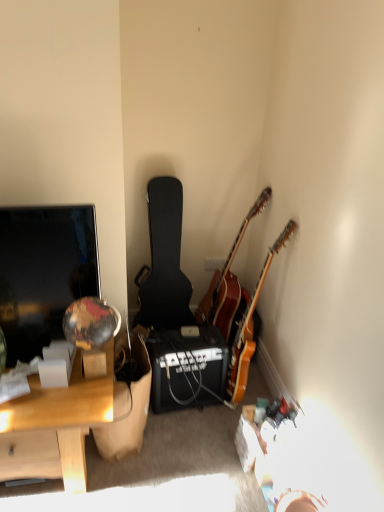
What do you see at coordinates (227, 281) in the screenshot? This screenshot has height=512, width=384. I see `wooden acoustic guitar at corner, which is the second guitar in left-to-right order` at bounding box center [227, 281].

The width and height of the screenshot is (384, 512). What are the coordinates of `black textured guitar case at center, which is the 1th guitar in left-to-right order` in the screenshot? It's located at (164, 261).

This screenshot has width=384, height=512. In order to click on wooden acoustic guitar at corner, which is the 2th guitar in right-to-left order in this screenshot , I will do `click(227, 281)`.

Can you confirm if black textured guitar case at center, which is the 1th guitar in left-to-right order, is shorter than black matte amplifier at center?

In fact, black textured guitar case at center, which is the 1th guitar in left-to-right order, may be taller than black matte amplifier at center.

Is black textured guitar case at center, which is the 1th guitar in left-to-right order, in contact with black matte amplifier at center?

No, black textured guitar case at center, which is the 1th guitar in left-to-right order, is not touching black matte amplifier at center.

From the image's perspective, is black textured guitar case at center, the 3th guitar viewed from the right, under black matte amplifier at center?

No, from the image's perspective, black textured guitar case at center, the 3th guitar viewed from the right, is not below black matte amplifier at center.

Locate an element on the screen. The height and width of the screenshot is (512, 384). guitar located on the left of black matte amplifier at center is located at coordinates (164, 261).

Is wooden acoustic guitar at corner, which is the second guitar in left-to-right order, thinner than matte black screen at left?

Incorrect, the width of wooden acoustic guitar at corner, which is the second guitar in left-to-right order, is not less than that of matte black screen at left.

Is wooden acoustic guitar at corner, which is the 2th guitar in right-to-left order, taller than matte black screen at left?

Indeed, wooden acoustic guitar at corner, which is the 2th guitar in right-to-left order, has a greater height compared to matte black screen at left.

What's the angular difference between wooden acoustic guitar at corner, which is the second guitar in left-to-right order, and matte black screen at left's facing directions?

The angle between the facing direction of wooden acoustic guitar at corner, which is the second guitar in left-to-right order, and the facing direction of matte black screen at left is 97.2 degrees.

Are wooden acoustic guitar at corner, which is the second guitar in left-to-right order, and matte black screen at left beside each other?

No, wooden acoustic guitar at corner, which is the second guitar in left-to-right order, is not with matte black screen at left.

Is wooden acoustic guitar at upper right, the first guitar positioned from the right, next to wooden acoustic guitar at corner, which is the second guitar in left-to-right order?

There is a gap between wooden acoustic guitar at upper right, the first guitar positioned from the right, and wooden acoustic guitar at corner, which is the second guitar in left-to-right order.

Considering the sizes of wooden acoustic guitar at upper right, the first guitar positioned from the right, and wooden acoustic guitar at corner, which is the second guitar in left-to-right order, in the image, is wooden acoustic guitar at upper right, the first guitar positioned from the right, bigger or smaller than wooden acoustic guitar at corner, which is the second guitar in left-to-right order,?

wooden acoustic guitar at upper right, the first guitar positioned from the right, is smaller than wooden acoustic guitar at corner, which is the second guitar in left-to-right order.

Is wooden acoustic guitar at upper right, the first guitar positioned from the right, wider than wooden acoustic guitar at corner, which is the second guitar in left-to-right order?

No.

Does point (257, 295) come behind point (226, 337)?

No, it is in front of (226, 337).

From the picture: Does wooden acoustic guitar at upper right, marked as the third guitar in a left-to-right arrangement, turn towards black textured guitar case at center, the 3th guitar viewed from the right?

No, wooden acoustic guitar at upper right, marked as the third guitar in a left-to-right arrangement, is not aimed at black textured guitar case at center, the 3th guitar viewed from the right.

From a real-world perspective, count 1st guitars upward from the wooden acoustic guitar at upper right, marked as the third guitar in a left-to-right arrangement, and point to it. Please provide its 2D coordinates.

[(164, 261)]

Would you say wooden acoustic guitar at upper right, the first guitar positioned from the right, is inside or outside black textured guitar case at center, the 3th guitar viewed from the right?

Answer: wooden acoustic guitar at upper right, the first guitar positioned from the right, lies outside black textured guitar case at center, the 3th guitar viewed from the right.

From the picture: In terms of width, does wooden acoustic guitar at upper right, the first guitar positioned from the right, look wider or thinner when compared to black textured guitar case at center, which is the 1th guitar in left-to-right order?

Clearly, wooden acoustic guitar at upper right, the first guitar positioned from the right, has less width compared to black textured guitar case at center, which is the 1th guitar in left-to-right order.

From a real-world perspective, which object stands above the other?

In real-world perspective, matte black screen at left is above.

Is matte black screen at left beside wooden desk at left?

No.

Is matte black screen at left not inside wooden desk at left?

Yes, matte black screen at left is located beyond the bounds of wooden desk at left.

Based on the photo, does matte black screen at left appear on the left side of wooden desk at left?

In fact, matte black screen at left is to the right of wooden desk at left.

From the image's perspective, which object appears higher, wooden desk at left or black textured guitar case at center, which is the 1th guitar in left-to-right order?

black textured guitar case at center, which is the 1th guitar in left-to-right order, appears higher in the image.

Is wooden desk at left not close to black textured guitar case at center, the 3th guitar viewed from the right?

No, wooden desk at left is not far away from black textured guitar case at center, the 3th guitar viewed from the right.

Looking at the image, does wooden desk at left seem bigger or smaller compared to black matte amplifier at center?

Clearly, wooden desk at left is larger in size than black matte amplifier at center.

Locate an element on the screen. desk that is on the left side of black matte amplifier at center is located at coordinates (55, 426).

Are wooden desk at left and black matte amplifier at center located far from each other?

No, wooden desk at left is not far from black matte amplifier at center.

There is a black matte amplifier at center. At what (x,y) coordinates should I click in order to perform the action: click on the 2nd guitar above it (from the image's perspective). Please return your answer as a coordinate pair (x, y). Image resolution: width=384 pixels, height=512 pixels. Looking at the image, I should click on (164, 261).

Locate an element on the screen. Image resolution: width=384 pixels, height=512 pixels. television located in front of the wooden acoustic guitar at corner, which is the second guitar in left-to-right order is located at coordinates (43, 273).

When comparing their distances from black textured guitar case at center, the 3th guitar viewed from the right, does wooden acoustic guitar at upper right, marked as the third guitar in a left-to-right arrangement, or wooden desk at left seem further?

wooden desk at left.

Considering their positions, is wooden acoustic guitar at upper right, the first guitar positioned from the right, positioned closer to black textured guitar case at center, which is the 1th guitar in left-to-right order, than matte black screen at left?

Among the two, wooden acoustic guitar at upper right, the first guitar positioned from the right, is located nearer to black textured guitar case at center, which is the 1th guitar in left-to-right order.

From the image, which object appears to be farther from matte black screen at left, wooden acoustic guitar at corner, which is the 2th guitar in right-to-left order, or wooden desk at left?

wooden acoustic guitar at corner, which is the 2th guitar in right-to-left order.

Considering their positions, is black textured guitar case at center, the 3th guitar viewed from the right, positioned closer to wooden desk at left than matte black screen at left?

Based on the image, matte black screen at left appears to be nearer to wooden desk at left.

Estimate the real-world distances between objects in this image. Which object is further from black matte amplifier at center, black textured guitar case at center, which is the 1th guitar in left-to-right order, or wooden acoustic guitar at upper right, the first guitar positioned from the right?

black textured guitar case at center, which is the 1th guitar in left-to-right order, is positioned further to the anchor black matte amplifier at center.

From the image, which object appears to be nearer to wooden acoustic guitar at upper right, marked as the third guitar in a left-to-right arrangement, black textured guitar case at center, which is the 1th guitar in left-to-right order, or matte black screen at left?

The object closer to wooden acoustic guitar at upper right, marked as the third guitar in a left-to-right arrangement, is black textured guitar case at center, which is the 1th guitar in left-to-right order.

Looking at the image, which one is located further to matte black screen at left, black matte amplifier at center or wooden acoustic guitar at corner, which is the second guitar in left-to-right order?

Among the two, wooden acoustic guitar at corner, which is the second guitar in left-to-right order, is located further to matte black screen at left.

Based on the photo, from the image, which object appears to be nearer to black textured guitar case at center, the 3th guitar viewed from the right, matte black screen at left or wooden acoustic guitar at upper right, marked as the third guitar in a left-to-right arrangement?

wooden acoustic guitar at upper right, marked as the third guitar in a left-to-right arrangement.

You are a GUI agent. You are given a task and a screenshot of the screen. Output one action in this format:
    pyautogui.click(x=<x>, y=<y>)
    Task: Click on the television between black textured guitar case at center, the 3th guitar viewed from the right, and wooden desk at left, in the vertical direction
    
    Given the screenshot: What is the action you would take?
    pyautogui.click(x=43, y=273)

You are a GUI agent. You are given a task and a screenshot of the screen. Output one action in this format:
    pyautogui.click(x=<x>, y=<y>)
    Task: Click on the loudspeaker between matte black screen at left and wooden acoustic guitar at corner, which is the second guitar in left-to-right order, in the horizontal direction
    This screenshot has height=512, width=384.
    Given the screenshot: What is the action you would take?
    tap(186, 368)

I want to click on guitar between black textured guitar case at center, the 3th guitar viewed from the right, and wooden acoustic guitar at upper right, the first guitar positioned from the right, from left to right, so click(x=227, y=281).

Find the location of a particular element. guitar between wooden desk at left and wooden acoustic guitar at corner, which is the 2th guitar in right-to-left order, from left to right is located at coordinates (164, 261).